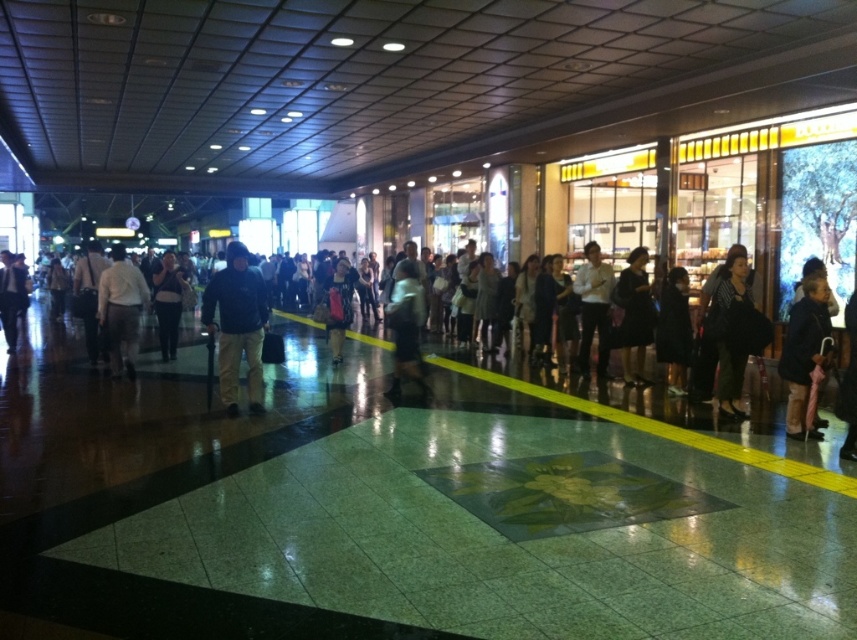
In the scene shown: You are standing at the entrance of the mall and see a dark gray coat at right and a dark gray sweater at center. You want to pick up the sweater first. Which item is closer to you?

The dark gray sweater at center is closer to you because it is only 4.74 meters away from the dark gray coat at right, so the sweater is nearer than the coat.

You are standing at the entrance of the shopping mall and see a dark blue fabric at center. Can you tell me what is located at the coordinates point (237, 324)?

The coordinates point (237, 324) corresponds to the location of the dark blue fabric at center.